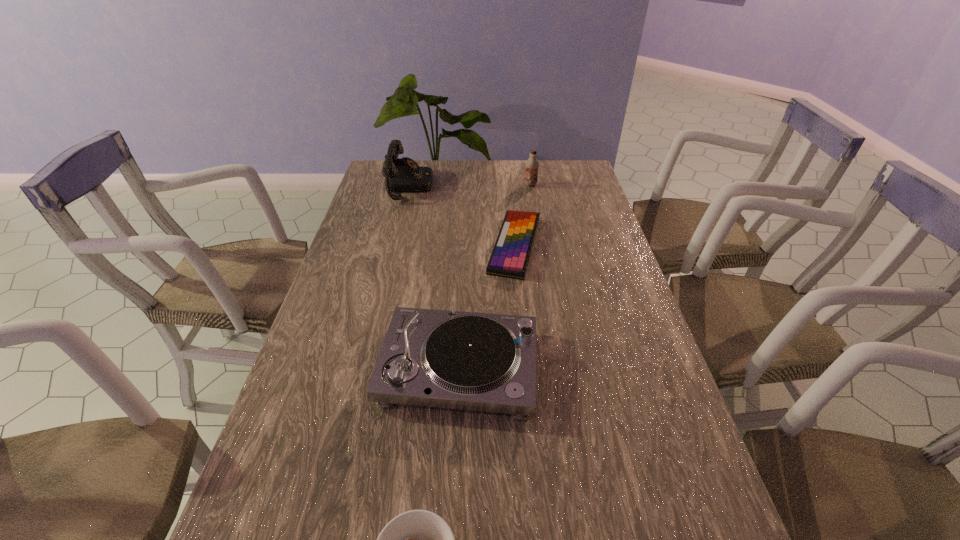
Locate an element on the screen. The height and width of the screenshot is (540, 960). telephone positioned at the far edge is located at coordinates (401, 175).

This screenshot has width=960, height=540. I want to click on chocolate milk that is at the far edge, so click(532, 164).

Locate an element on the screen. The image size is (960, 540). object at the left edge is located at coordinates (401, 175).

The width and height of the screenshot is (960, 540). I want to click on object present at the far left corner, so click(x=401, y=175).

The width and height of the screenshot is (960, 540). Find the location of `vacant space at the far edge of the desktop`. vacant space at the far edge of the desktop is located at coordinates (487, 182).

Locate an element on the screen. vacant space at the left edge is located at coordinates (370, 319).

In the image, there is a desktop. Identify the location of free space at the right edge. (611, 380).

Where is `vacant space at the far left corner of the desktop`? This screenshot has width=960, height=540. vacant space at the far left corner of the desktop is located at coordinates (379, 187).

In the image, there is a desktop. In order to click on blank space at the far right corner in this screenshot , I will do `click(553, 182)`.

Where is `free space that is in between the telephone and the chocolate milk`? The height and width of the screenshot is (540, 960). free space that is in between the telephone and the chocolate milk is located at coordinates (470, 185).